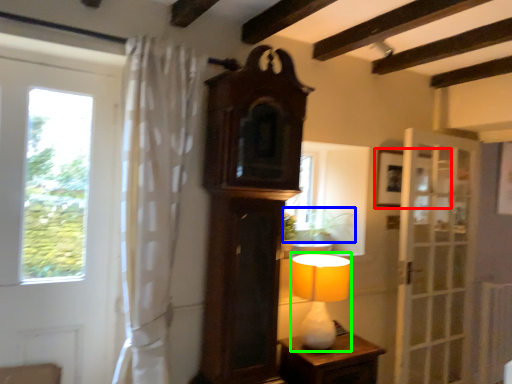
Question: Estimate the real-world distances between objects in this image. Which object is closer to picture frame (highlighted by a red box), plant (highlighted by a blue box) or table lamp (highlighted by a green box)?

Choices:
 (A) plant
 (B) table lamp

Answer: (A)